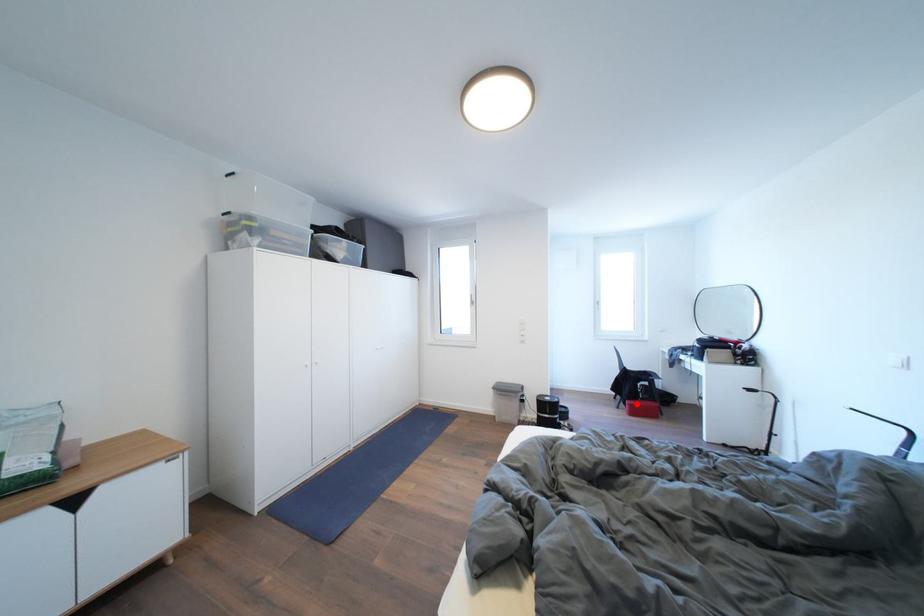
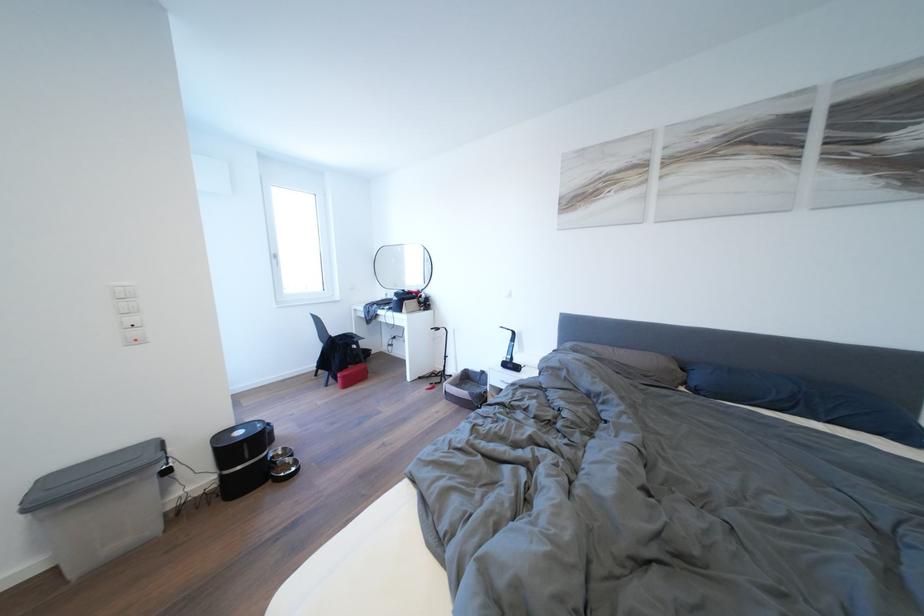
Find the pixel in the second image that matches the highlighted location in the first image.

(348, 376)